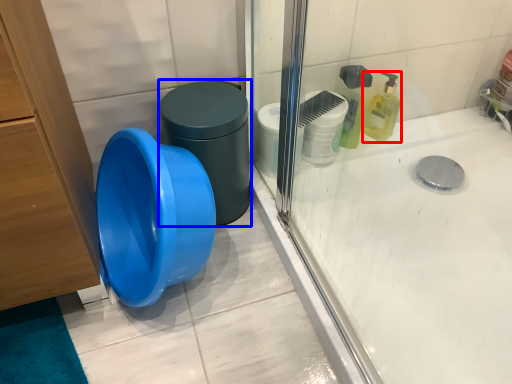
Question: Which point is closer to the camera, cleaning product (highlighted by a red box) or potty (highlighted by a blue box)?

Choices:
 (A) cleaning product
 (B) potty

Answer: (B)